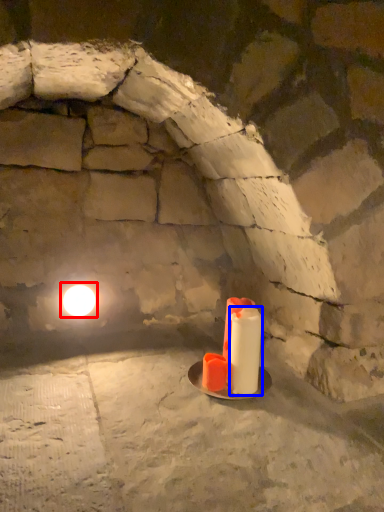
Question: Which point is further to the camera, light (highlighted by a red box) or candle (highlighted by a blue box)?

Choices:
 (A) light
 (B) candle

Answer: (A)